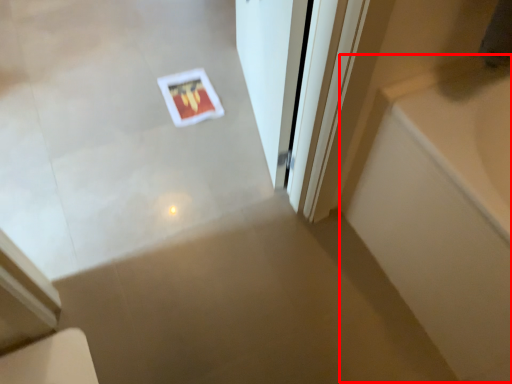
Question: From the image's perspective, where is bath (annotated by the red box) located in relation to door in the image?

Choices:
 (A) above
 (B) below

Answer: (B)